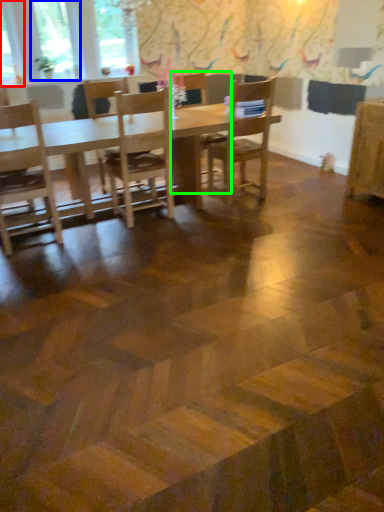
Question: Which object is the farthest from window (highlighted by a red box)? Choose among these: window (highlighted by a blue box) or chair (highlighted by a green box).

Choices:
 (A) window
 (B) chair

Answer: (B)